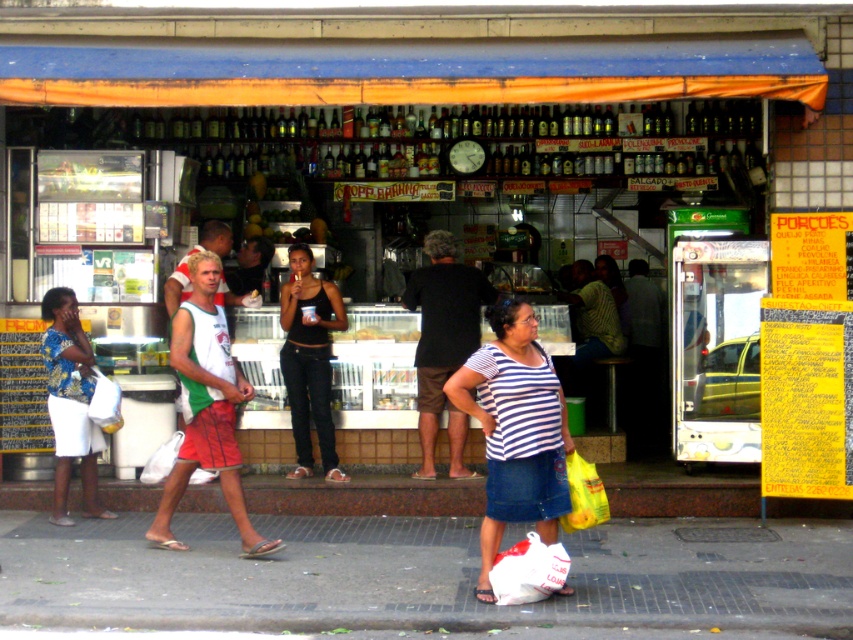
From the picture: Does striped cotton shirt at center have a lesser height compared to printed fabric skirt at lower left?

In fact, striped cotton shirt at center may be taller than printed fabric skirt at lower left.

Who is lower down, striped cotton shirt at center or printed fabric skirt at lower left?

striped cotton shirt at center is lower down.

Which is in front, point (508, 397) or point (84, 474)?

Point (508, 397) is in front.

Where is `striped cotton shirt at center`? The image size is (853, 640). striped cotton shirt at center is located at coordinates (515, 429).

Can you confirm if smooth concrete pavement at lower center is taller than striped cotton shirt at center?

No, smooth concrete pavement at lower center is not taller than striped cotton shirt at center.

Between point (276, 593) and point (560, 410), which one is positioned in front?

Point (560, 410)

Does point (32, 531) come behind point (486, 515)?

Yes.

Identify the location of smooth concrete pavement at lower center. The image size is (853, 640). [x=421, y=577].

Who is shorter, striped cotton shirt at center or black matte tank top at center?

Standing shorter between the two is striped cotton shirt at center.

Which of these two, striped cotton shirt at center or black matte tank top at center, stands taller?

black matte tank top at center

Who is more forward, (492,538) or (294,312)?

Positioned in front is point (492,538).

Locate an element on the screen. The width and height of the screenshot is (853, 640). striped cotton shirt at center is located at coordinates (515, 429).